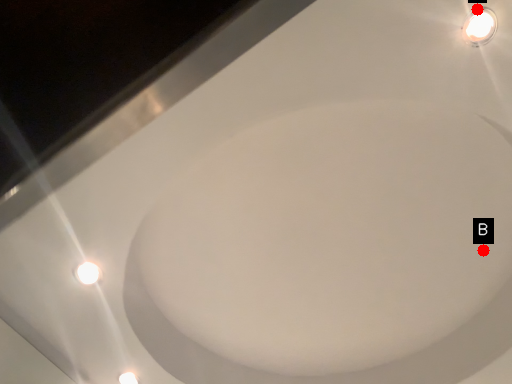
Question: Two points are circled on the image, labeled by A and B beside each circle. Which point appears closest to the camera in this image?

Choices:
 (A) A is closer
 (B) B is closer

Answer: (A)